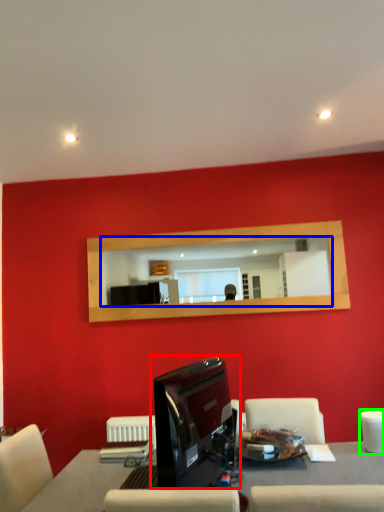
Question: Which is nearer to the computer monitor (highlighted by a red box)? mirror (highlighted by a blue box) or armchair (highlighted by a green box).

Choices:
 (A) mirror
 (B) armchair

Answer: (B)